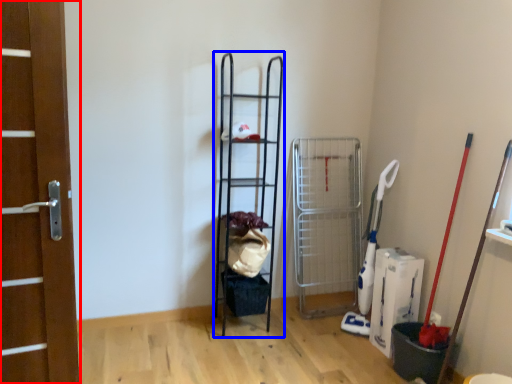
Question: Which object is closer to the camera taking this photo, door (highlighted by a red box) or ladder (highlighted by a blue box)?

Choices:
 (A) door
 (B) ladder

Answer: (A)